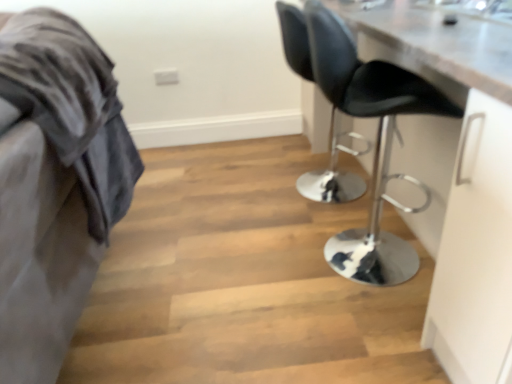
Question: From the image's perspective, does velvet grey blanket at left appear lower than black leather chair at center, which ranks as the 2th chair in front-to-back order?

Choices:
 (A) yes
 (B) no

Answer: (A)

Question: Considering the relative sizes of velvet grey blanket at left and black leather chair at center, which ranks as the 2th chair in front-to-back order, in the image provided, is velvet grey blanket at left bigger than black leather chair at center, which ranks as the 2th chair in front-to-back order,?

Choices:
 (A) yes
 (B) no

Answer: (A)

Question: Is velvet grey blanket at left at the left side of black leather chair at center, which ranks as the 2th chair in front-to-back order?

Choices:
 (A) yes
 (B) no

Answer: (A)

Question: Is velvet grey blanket at left not within black leather chair at center, the first chair when ordered from back to front?

Choices:
 (A) yes
 (B) no

Answer: (A)

Question: Is velvet grey blanket at left far away from black leather chair at center, which ranks as the 2th chair in front-to-back order?

Choices:
 (A) yes
 (B) no

Answer: (A)

Question: From the image's perspective, is black leather chair at right, which appears as the 2th chair when viewed from the back, above or below velvet grey blanket at left?

Choices:
 (A) below
 (B) above

Answer: (B)

Question: In terms of size, does black leather chair at right, which is the 1th chair from front to back, appear bigger or smaller than velvet grey blanket at left?

Choices:
 (A) small
 (B) big

Answer: (A)

Question: Is black leather chair at right, which is the 1th chair from front to back, spatially inside velvet grey blanket at left, or outside of it?

Choices:
 (A) outside
 (B) inside

Answer: (A)

Question: In terms of width, does black leather chair at right, which is the 1th chair from front to back, look wider or thinner when compared to velvet grey blanket at left?

Choices:
 (A) wide
 (B) thin

Answer: (B)

Question: Would you say velvet grey blanket at left is to the left or to the right of black leather chair at center, the first chair when ordered from back to front, in the picture?

Choices:
 (A) right
 (B) left

Answer: (B)

Question: Is velvet grey blanket at left in front of or behind black leather chair at center, the first chair when ordered from back to front, in the image?

Choices:
 (A) front
 (B) behind

Answer: (A)

Question: Does point (74, 193) appear closer or farther from the camera than point (338, 175)?

Choices:
 (A) farther
 (B) closer

Answer: (B)

Question: From a real-world perspective, relative to black leather chair at center, the first chair when ordered from back to front, is velvet grey blanket at left vertically above or below?

Choices:
 (A) above
 (B) below

Answer: (A)

Question: Considering the relative positions of velvet grey blanket at left and black leather chair at right, which appears as the 2th chair when viewed from the back, in the image provided, is velvet grey blanket at left to the left or to the right of black leather chair at right, which appears as the 2th chair when viewed from the back,?

Choices:
 (A) right
 (B) left

Answer: (B)

Question: Is point (73, 173) closer or farther from the camera than point (402, 96)?

Choices:
 (A) farther
 (B) closer

Answer: (B)